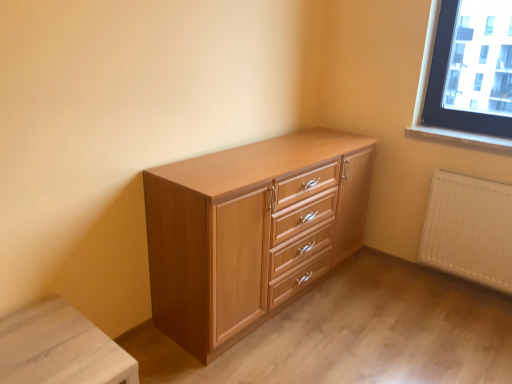
Question: From a real-world perspective, is smooth wood window sill at upper right under white matte radiator at lower right?

Choices:
 (A) no
 (B) yes

Answer: (A)

Question: Can you confirm if smooth wood window sill at upper right is bigger than white matte radiator at lower right?

Choices:
 (A) no
 (B) yes

Answer: (A)

Question: Would you say smooth wood window sill at upper right contains white matte radiator at lower right?

Choices:
 (A) yes
 (B) no

Answer: (B)

Question: Are smooth wood window sill at upper right and white matte radiator at lower right beside each other?

Choices:
 (A) no
 (B) yes

Answer: (A)

Question: Is smooth wood window sill at upper right completely or partially outside of white matte radiator at lower right?

Choices:
 (A) yes
 (B) no

Answer: (A)

Question: Is smooth wood window sill at upper right wider than white matte radiator at lower right?

Choices:
 (A) no
 (B) yes

Answer: (B)

Question: Is light brown wood chest of drawers at center thinner than smooth wood window sill at upper right?

Choices:
 (A) yes
 (B) no

Answer: (B)

Question: From the image's perspective, is light brown wood chest of drawers at center below smooth wood window sill at upper right?

Choices:
 (A) yes
 (B) no

Answer: (A)

Question: From a real-world perspective, is light brown wood chest of drawers at center over smooth wood window sill at upper right?

Choices:
 (A) no
 (B) yes

Answer: (A)

Question: Does light brown wood chest of drawers at center have a smaller size compared to smooth wood window sill at upper right?

Choices:
 (A) no
 (B) yes

Answer: (A)

Question: Is light brown wood chest of drawers at center taller than smooth wood window sill at upper right?

Choices:
 (A) yes
 (B) no

Answer: (A)

Question: Is the surface of light brown wood chest of drawers at center in direct contact with smooth wood window sill at upper right?

Choices:
 (A) no
 (B) yes

Answer: (A)

Question: Is smooth wood window sill at upper right positioned beyond the bounds of light brown wood chest of drawers at center?

Choices:
 (A) yes
 (B) no

Answer: (A)